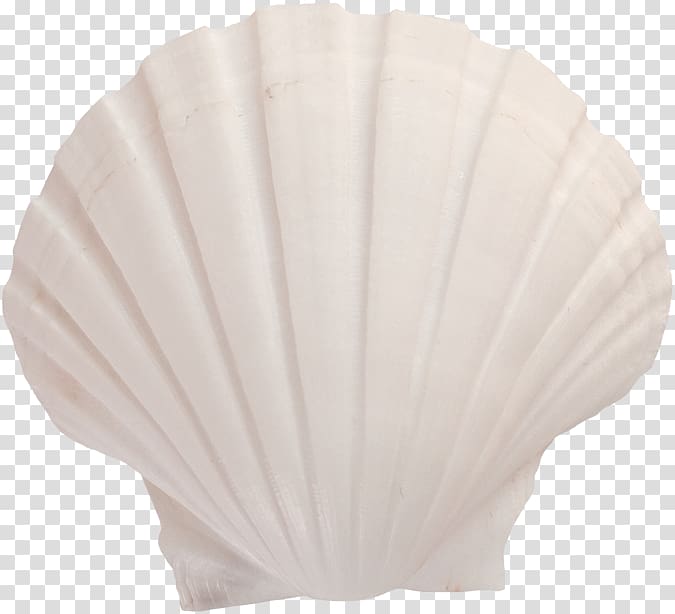
What are the coordinates of `upper left tile background` in the screenshot? It's located at (79, 45).